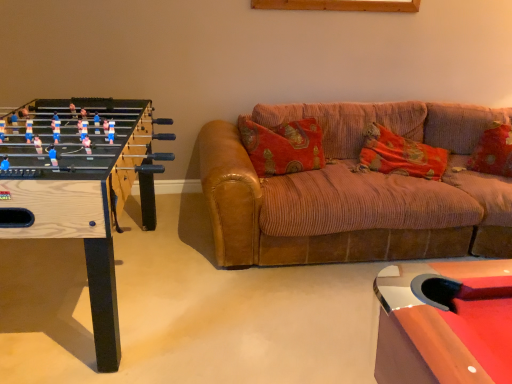
Question: From the image's perspective, does velvet-like red pillow at right, the first pillow viewed from the right, appear higher than wooden foosball table at left?

Choices:
 (A) yes
 (B) no

Answer: (A)

Question: Considering the relative sizes of velvet-like red pillow at right, the first pillow viewed from the right, and wooden foosball table at left in the image provided, is velvet-like red pillow at right, the first pillow viewed from the right, taller than wooden foosball table at left?

Choices:
 (A) yes
 (B) no

Answer: (B)

Question: Considering the relative sizes of velvet-like red pillow at right, the first pillow viewed from the right, and wooden foosball table at left in the image provided, is velvet-like red pillow at right, the first pillow viewed from the right, shorter than wooden foosball table at left?

Choices:
 (A) yes
 (B) no

Answer: (A)

Question: From the image's perspective, does velvet-like red pillow at right, which is the second pillow in left-to-right order, appear lower than wooden foosball table at left?

Choices:
 (A) yes
 (B) no

Answer: (B)

Question: Can you confirm if velvet-like red pillow at right, which is the second pillow in left-to-right order, is wider than wooden foosball table at left?

Choices:
 (A) no
 (B) yes

Answer: (A)

Question: In terms of size, does wooden foosball table at left appear bigger or smaller than velvet-like red pillow at right, which is the second pillow in left-to-right order?

Choices:
 (A) small
 (B) big

Answer: (B)

Question: Does point (10, 148) appear closer or farther from the camera than point (508, 162)?

Choices:
 (A) closer
 (B) farther

Answer: (A)

Question: Relative to velvet-like red pillow at right, which is the second pillow in left-to-right order, is wooden foosball table at left in front or behind?

Choices:
 (A) behind
 (B) front

Answer: (B)

Question: Based on their positions, is wooden foosball table at left located to the left or right of velvet-like red pillow at right, which is the second pillow in left-to-right order?

Choices:
 (A) right
 (B) left

Answer: (B)

Question: From a real-world perspective, is orange corduroy pillow at center, the 2th pillow positioned from the right, above or below velvet-like red pillow at right, the first pillow viewed from the right?

Choices:
 (A) below
 (B) above

Answer: (A)

Question: Would you say orange corduroy pillow at center, the 1th pillow from the left, is to the left or to the right of velvet-like red pillow at right, the first pillow viewed from the right, in the picture?

Choices:
 (A) right
 (B) left

Answer: (B)

Question: Is orange corduroy pillow at center, the 2th pillow positioned from the right, in front of or behind velvet-like red pillow at right, which is the second pillow in left-to-right order, in the image?

Choices:
 (A) behind
 (B) front

Answer: (B)

Question: Looking at their shapes, would you say orange corduroy pillow at center, the 2th pillow positioned from the right, is wider or thinner than velvet-like red pillow at right, the first pillow viewed from the right?

Choices:
 (A) thin
 (B) wide

Answer: (B)

Question: Does point (499, 157) appear closer or farther from the camera than point (372, 134)?

Choices:
 (A) farther
 (B) closer

Answer: (B)

Question: From the image's perspective, is velvet-like red pillow at right, the first pillow viewed from the right, located above or below orange corduroy pillow at center, the 1th pillow from the left?

Choices:
 (A) below
 (B) above

Answer: (B)